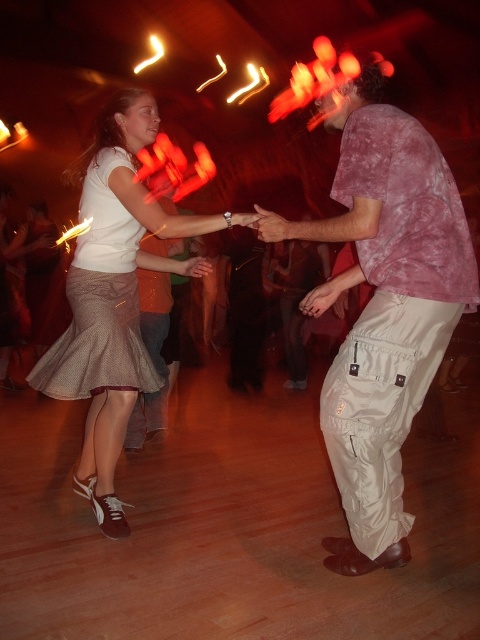
Does white cotton skirt at center have a lesser height compared to brown textured skirt at center?

No, white cotton skirt at center is not shorter than brown textured skirt at center.

Is point (93, 177) farther from viewer compared to point (113, 285)?

No.

Find the location of `white cotton skirt at center`. white cotton skirt at center is located at coordinates pyautogui.click(x=115, y=296).

Does maroon tie-dye shirt at right have a larger size compared to white cotton skirt at center?

Yes, maroon tie-dye shirt at right is bigger than white cotton skirt at center.

Is maroon tie-dye shirt at right below white cotton skirt at center?

Yes.

The width and height of the screenshot is (480, 640). What are the coordinates of `maroon tie-dye shirt at right` in the screenshot? It's located at [384, 308].

Is maroon tie-dye shirt at right to the right of brown textured skirt at center from the viewer's perspective?

Correct, you'll find maroon tie-dye shirt at right to the right of brown textured skirt at center.

Is maroon tie-dye shirt at right to the left of brown textured skirt at center from the viewer's perspective?

Incorrect, maroon tie-dye shirt at right is not on the left side of brown textured skirt at center.

What do you see at coordinates (384, 308) in the screenshot?
I see `maroon tie-dye shirt at right` at bounding box center [384, 308].

Locate an element on the screen. maroon tie-dye shirt at right is located at coordinates (384, 308).